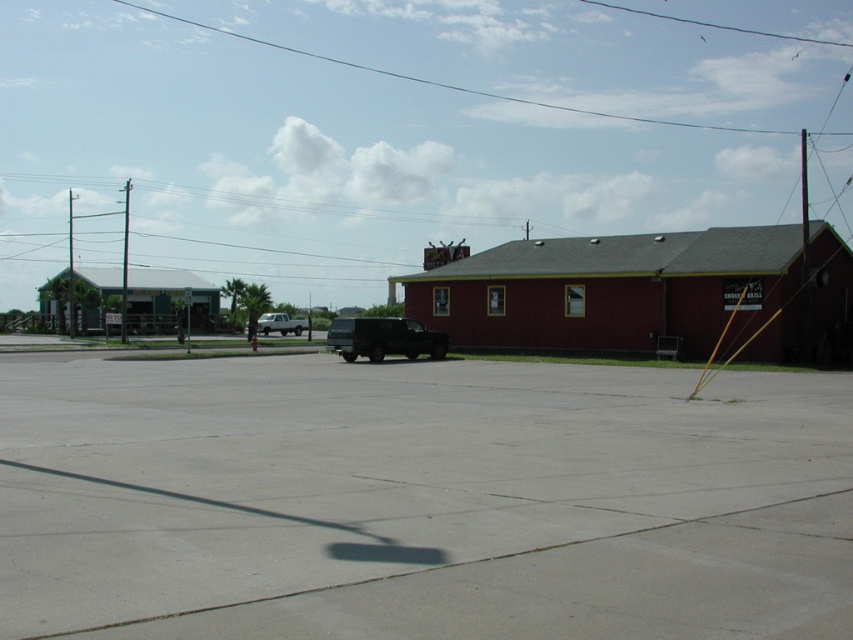
Which is more to the right, gray concrete parking lot at center or shiny black truck at center?

gray concrete parking lot at center is more to the right.

Is gray concrete parking lot at center further to camera compared to shiny black truck at center?

That is False.

I want to click on gray concrete parking lot at center, so click(x=419, y=500).

Between point (144, 10) and point (260, 323), which one is positioned behind?

Point (144, 10)

Does smooth wire power line at upper center appear under white matte van at center?

No, smooth wire power line at upper center is not below white matte van at center.

This screenshot has width=853, height=640. What are the coordinates of `smooth wire power line at upper center` in the screenshot? It's located at (448, 83).

Between shiny black truck at center and brushed metal pole at left, which one has less height?

shiny black truck at center is shorter.

You are a GUI agent. You are given a task and a screenshot of the screen. Output one action in this format:
    pyautogui.click(x=<x>, y=<y>)
    Task: Click on the shiny black truck at center
    
    Given the screenshot: What is the action you would take?
    coord(383,339)

Identify the location of shiny black truck at center. (383, 339).